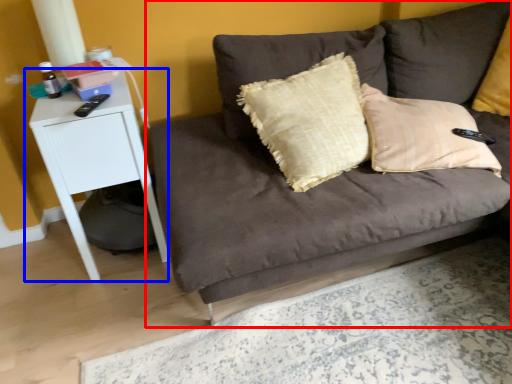
Question: Which object is closer to the camera taking this photo, studio couch (highlighted by a red box) or table (highlighted by a blue box)?

Choices:
 (A) studio couch
 (B) table

Answer: (A)